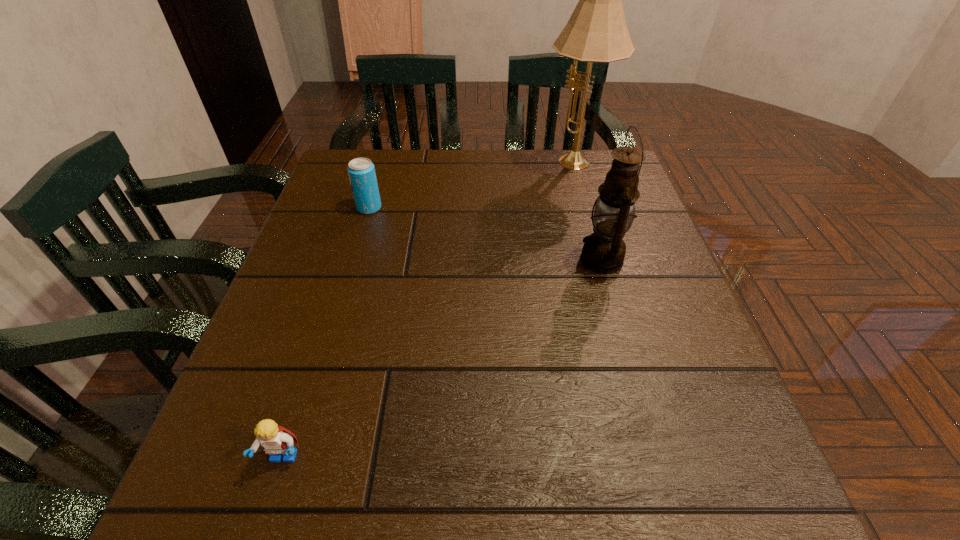
Where is `vacant space situated on the front of the third tallest object`? This screenshot has height=540, width=960. vacant space situated on the front of the third tallest object is located at coordinates (355, 255).

Identify the location of vacant space located 0.060m on the front-facing side of the shortest object. The height and width of the screenshot is (540, 960). (263, 522).

Where is `object positioned at the far edge`? Image resolution: width=960 pixels, height=540 pixels. object positioned at the far edge is located at coordinates (596, 32).

In order to click on object at the near edge in this screenshot , I will do `click(275, 440)`.

Where is `soda can that is at the left edge`? The image size is (960, 540). soda can that is at the left edge is located at coordinates (361, 171).

Where is `Lego at the left edge`? Image resolution: width=960 pixels, height=540 pixels. Lego at the left edge is located at coordinates (275, 440).

Find the location of `lampshade located in the right edge section of the desktop`. lampshade located in the right edge section of the desktop is located at coordinates (596, 32).

Locate an element on the screen. The image size is (960, 540). oil lamp that is at the right edge is located at coordinates (603, 251).

Where is `object present at the near left corner`? The height and width of the screenshot is (540, 960). object present at the near left corner is located at coordinates (275, 440).

Identify the location of object located at the far right corner. (596, 32).